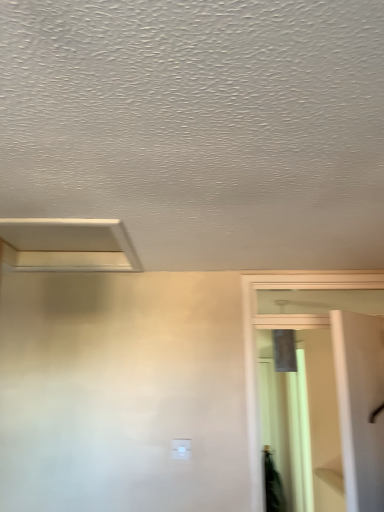
Question: Is clear glass screen door at right in front of or behind white matte exhaust hood at upper left in the image?

Choices:
 (A) front
 (B) behind

Answer: (B)

Question: From their relative heights in the image, would you say clear glass screen door at right is taller or shorter than white matte exhaust hood at upper left?

Choices:
 (A) short
 (B) tall

Answer: (B)

Question: Based on their relative distances, which object is farther from the white plastic light switch at center?

Choices:
 (A) white matte exhaust hood at upper left
 (B) clear glass screen door at right

Answer: (A)

Question: Estimate the real-world distances between objects in this image. Which object is closer to the white plastic light switch at center?

Choices:
 (A) white matte exhaust hood at upper left
 (B) clear glass screen door at right

Answer: (B)